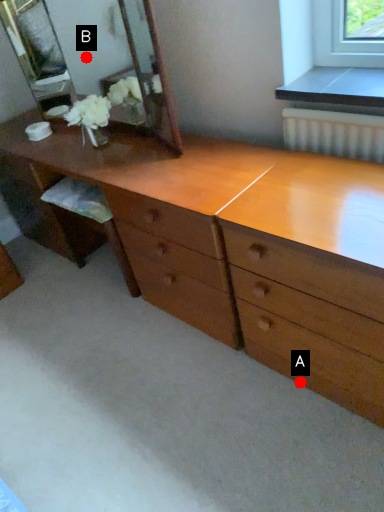
Question: Two points are circled on the image, labeled by A and B beside each circle. Which point appears farthest from the camera in this image?

Choices:
 (A) A is further
 (B) B is further

Answer: (B)